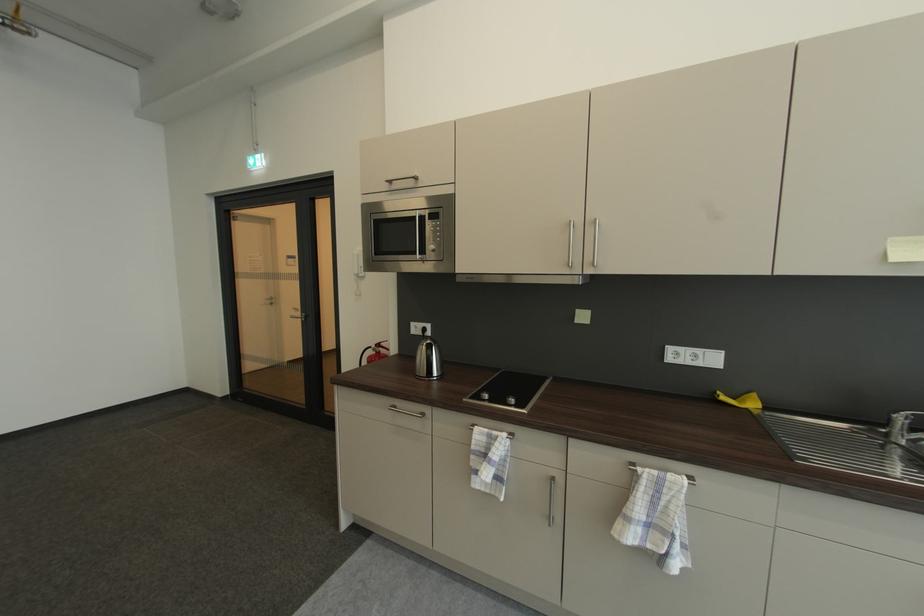
The height and width of the screenshot is (616, 924). Find the location of `sink faucet handle`. sink faucet handle is located at coordinates (902, 426).